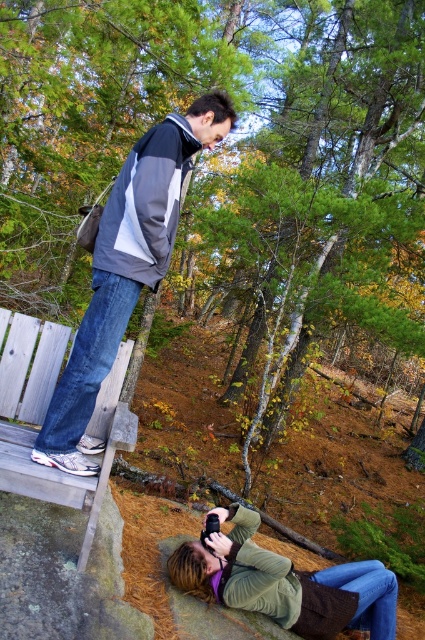
You are a photographer trying to capture the autumn scenery. You have a green fuzzy jacket at lower center and a gray wood bench at lower left in your viewfinder. Which object should you adjust your camera focus on if you want to ensure the smaller object is in sharp detail?

The green fuzzy jacket at lower center is smaller than the gray wood bench at lower left. To ensure the smaller object is in sharp detail, focus on the green fuzzy jacket at lower center.